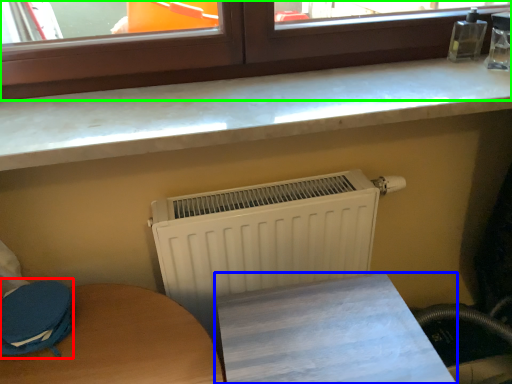
Question: Estimate the real-world distances between objects in this image. Which object is closer to swivel chair (highlighted by a red box), furniture (highlighted by a blue box) or window (highlighted by a green box)?

Choices:
 (A) furniture
 (B) window

Answer: (A)